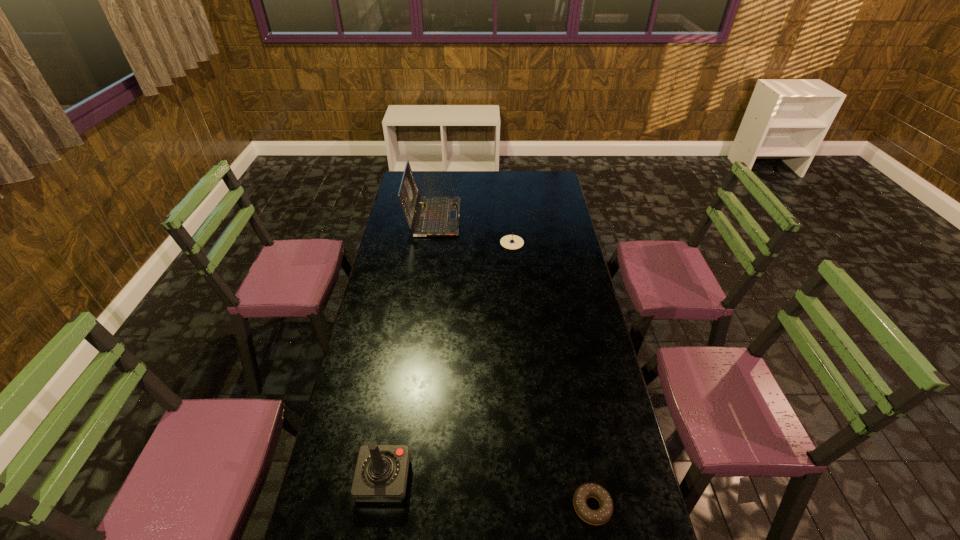
This screenshot has height=540, width=960. In order to click on laptop computer in this screenshot , I will do `click(437, 216)`.

The image size is (960, 540). In order to click on the second tallest object in this screenshot , I will do `click(381, 473)`.

Where is `the third object from left to right`? This screenshot has width=960, height=540. the third object from left to right is located at coordinates (512, 242).

I want to click on compass, so click(x=512, y=242).

Image resolution: width=960 pixels, height=540 pixels. What are the coordinates of `the rightmost object` in the screenshot? It's located at click(600, 516).

I want to click on the shortest object, so click(x=600, y=516).

Where is `free space located 0.330m on the screen of the tallest object`? The image size is (960, 540). free space located 0.330m on the screen of the tallest object is located at coordinates (524, 218).

This screenshot has height=540, width=960. Identify the location of free spot located 0.050m on the front-facing side of the joystick. pyautogui.click(x=426, y=479).

This screenshot has width=960, height=540. Identify the location of vacant area situated on the left of the third object from left to right. (454, 242).

The width and height of the screenshot is (960, 540). Find the location of `vacant space situated 0.060m on the right of the shortest object`. vacant space situated 0.060m on the right of the shortest object is located at coordinates (633, 507).